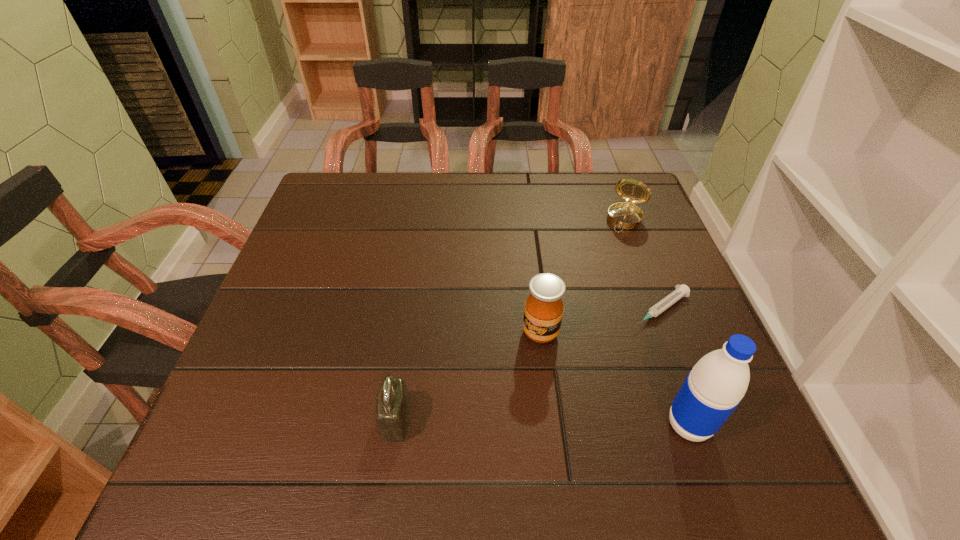
I want to click on vacant space in between the shortest object and the water bottle, so (x=675, y=367).

Find the location of a particular element. object identified as the third closest to the syringe is located at coordinates (626, 215).

The height and width of the screenshot is (540, 960). What are the coordinates of `object that is the fourth nearest to the tallest object` in the screenshot? It's located at (626, 215).

Identify the location of vacant space that satisfies the following two spatial constraints: 1. on the back side of the compass; 2. on the right side of the fourth object from right to left. (527, 219).

What are the coordinates of `free space that satisfies the following two spatial constraints: 1. on the back side of the syringe; 2. on the left side of the honey` in the screenshot? It's located at (538, 309).

The width and height of the screenshot is (960, 540). In order to click on vacant area in the image that satisfies the following two spatial constraints: 1. on the back side of the compass; 2. on the right side of the water bottle in this screenshot , I will do `click(616, 219)`.

Where is `free location that satisfies the following two spatial constraints: 1. on the front side of the honey; 2. on the left side of the water bottle`? free location that satisfies the following two spatial constraints: 1. on the front side of the honey; 2. on the left side of the water bottle is located at coordinates (552, 425).

Locate an element on the screen. free spot that satisfies the following two spatial constraints: 1. on the front side of the honey; 2. on the right side of the tallest object is located at coordinates (552, 425).